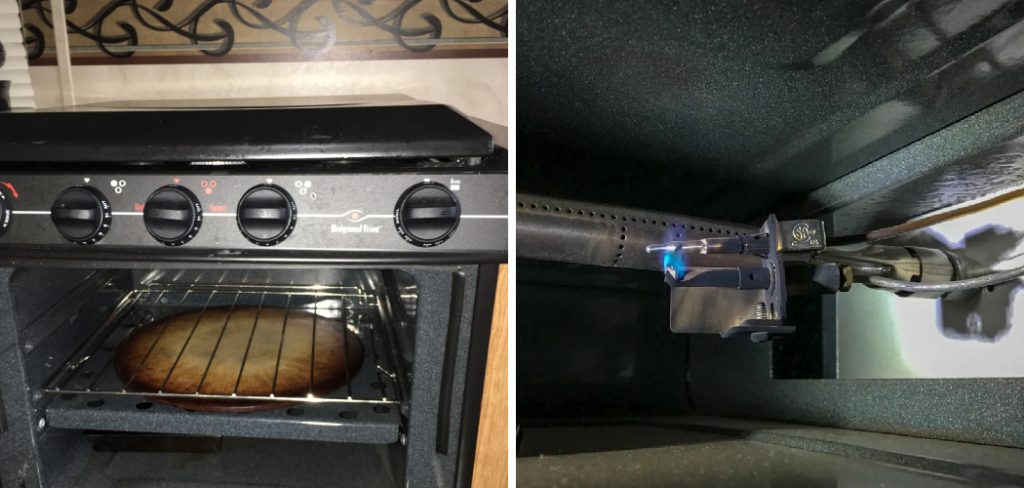
Locate an element on the screen. Image resolution: width=1024 pixels, height=488 pixels. gray floor is located at coordinates click(697, 448).